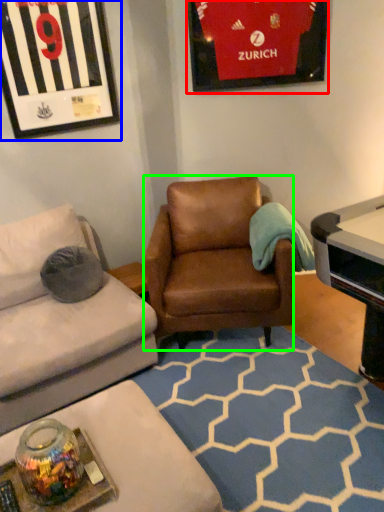
Question: Which object is positioned closest to picture frame (highlighted by a red box)? Select from picture frame (highlighted by a blue box) and chair (highlighted by a green box).

Choices:
 (A) picture frame
 (B) chair

Answer: (A)